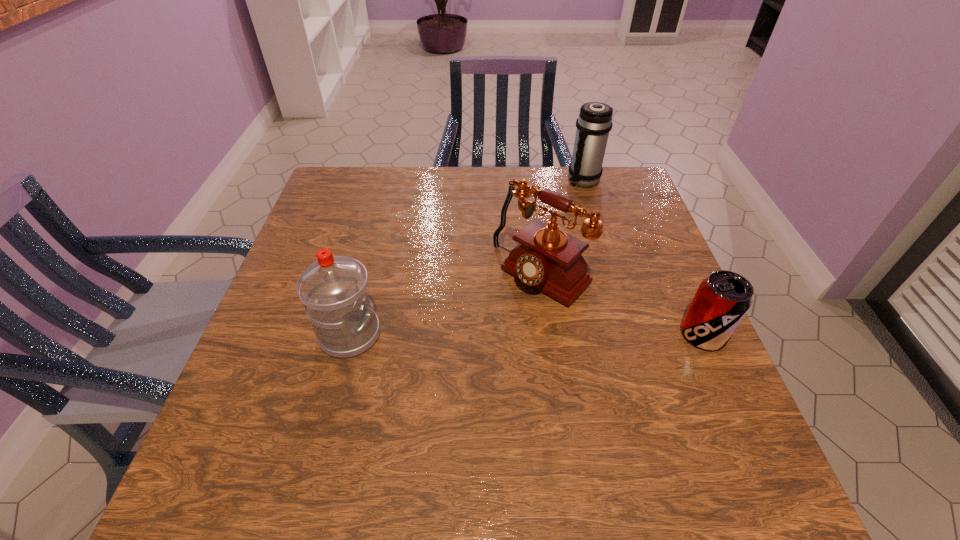
Locate an element on the screen. free space located on the dial of the third object from right to left is located at coordinates [x=499, y=314].

Identify the location of vacant area situated 0.090m on the dial of the third object from right to left. (488, 325).

The width and height of the screenshot is (960, 540). What are the coordinates of `vacant area located on the side with the handle of the thermos bottle` in the screenshot? It's located at (553, 231).

Locate an element on the screen. vacant point located 0.250m on the side with the handle of the thermos bottle is located at coordinates (549, 237).

I want to click on blank space located 0.290m on the side with the handle of the thermos bottle, so click(544, 246).

The image size is (960, 540). Find the location of `object situated at the far edge`. object situated at the far edge is located at coordinates (594, 123).

Identify the location of object at the left edge. Image resolution: width=960 pixels, height=540 pixels. (334, 289).

What are the coordinates of `soda can present at the right edge` in the screenshot? It's located at click(722, 299).

Where is `thermos bottle at the right edge`? The height and width of the screenshot is (540, 960). thermos bottle at the right edge is located at coordinates (594, 123).

Locate an element on the screen. The width and height of the screenshot is (960, 540). object that is at the far right corner is located at coordinates 594,123.